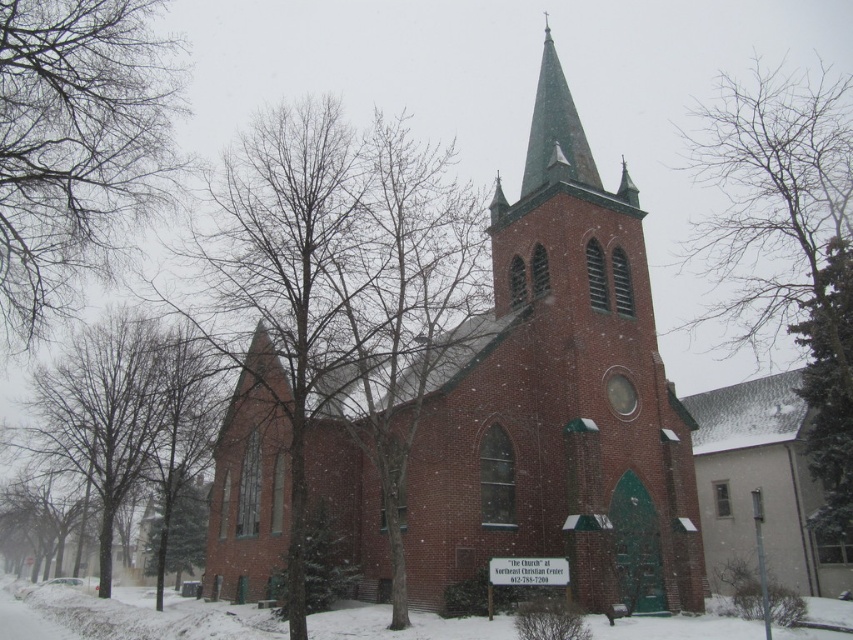
Question: Which point is closer to the camera?

Choices:
 (A) (583, 230)
 (B) (554, 93)
 (C) (1, 163)

Answer: (C)

Question: Does bare branches at center have a lesser width compared to green textured evergreen tree at lower left?

Choices:
 (A) yes
 (B) no

Answer: (B)

Question: Is brick church at center positioned before green textured evergreen tree at right?

Choices:
 (A) no
 (B) yes

Answer: (B)

Question: Which object appears closest to the camera in this image?

Choices:
 (A) green textured evergreen tree at right
 (B) bare branches at left

Answer: (B)

Question: Does bare branches at left have a larger size compared to green shingled spire at upper center?

Choices:
 (A) no
 (B) yes

Answer: (B)

Question: Which object appears farthest from the camera in this image?

Choices:
 (A) bare branches at left
 (B) bare branches at center
 (C) green textured evergreen tree at right

Answer: (C)